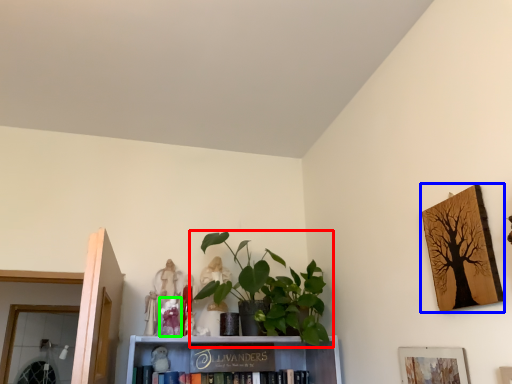
Question: Which object is positioned closest to houseplant (highlighted by a red box)? Select from picture frame (highlighted by a blue box) and toy (highlighted by a green box).

Choices:
 (A) picture frame
 (B) toy

Answer: (B)